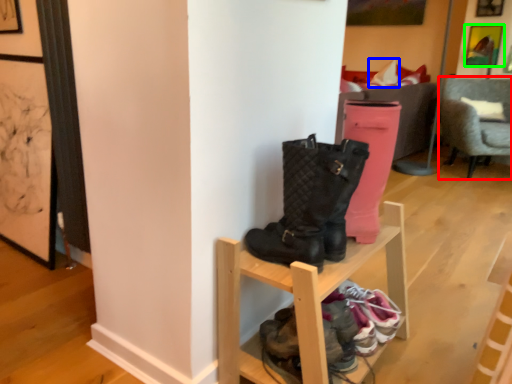
Question: Which object is positioned closest to chair (highlighted by a red box)? Select from pillow (highlighted by a blue box) and picture frame (highlighted by a green box).

Choices:
 (A) pillow
 (B) picture frame

Answer: (A)